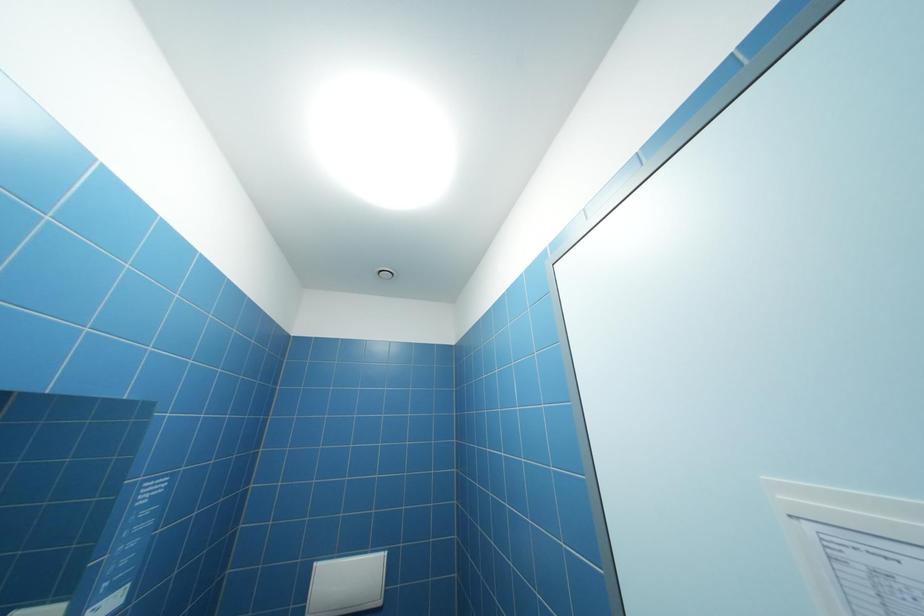
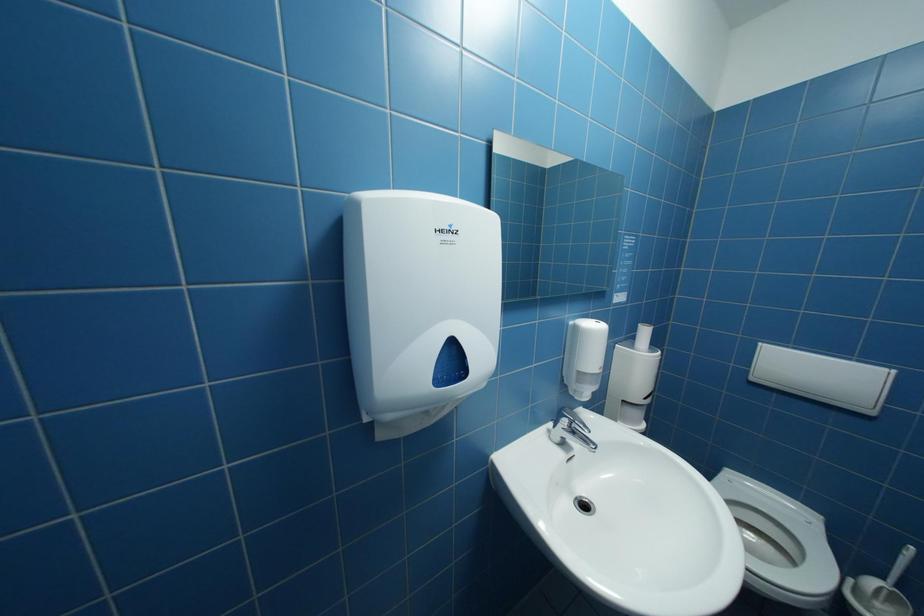
How did the camera likely rotate?

The camera's rotation is toward left-down.